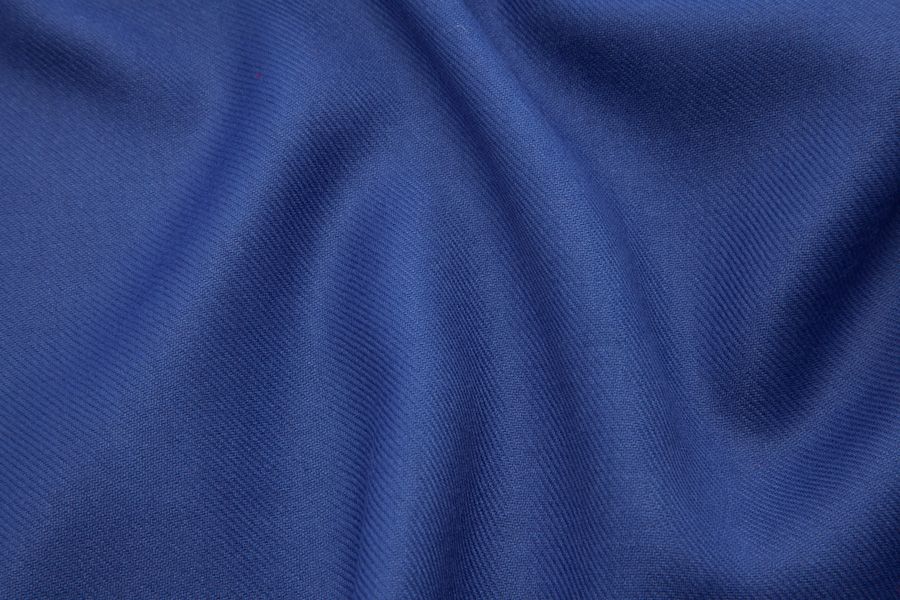
Identify the location of inside corner on the upper right hand side. The image size is (900, 600). (887, 17).